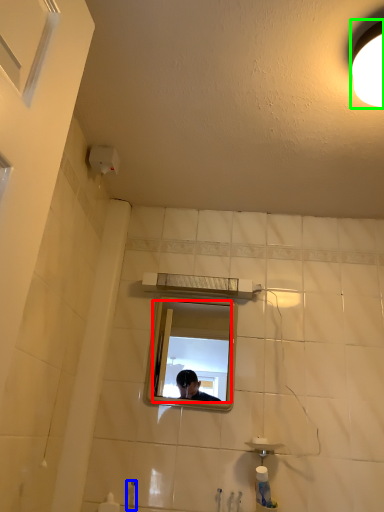
Question: Which is nearer to the mirror (highlighted by a red box)? faucet (highlighted by a blue box) or light fixture (highlighted by a green box).

Choices:
 (A) faucet
 (B) light fixture

Answer: (A)